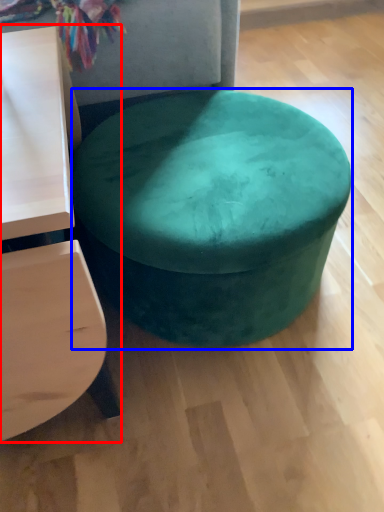
Question: Which object appears farthest to the camera in this image, table (highlighted by a red box) or stool (highlighted by a blue box)?

Choices:
 (A) table
 (B) stool

Answer: (B)